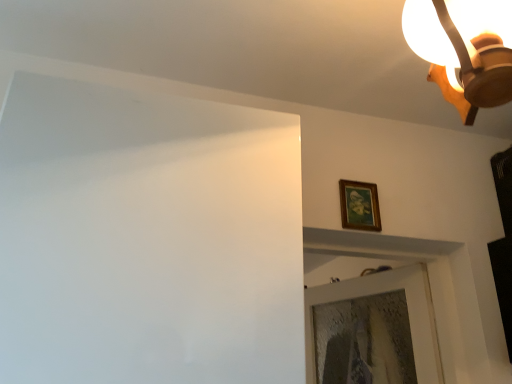
Question: Is wooden framed painting at upper right taller or shorter than wooden ceiling light at upper right?

Choices:
 (A) tall
 (B) short

Answer: (B)

Question: In terms of size, does wooden framed painting at upper right appear bigger or smaller than wooden ceiling light at upper right?

Choices:
 (A) big
 (B) small

Answer: (B)

Question: Considering the positions of wooden framed painting at upper right and wooden ceiling light at upper right in the image, is wooden framed painting at upper right wider or thinner than wooden ceiling light at upper right?

Choices:
 (A) thin
 (B) wide

Answer: (A)

Question: Choose the correct answer: Is wooden ceiling light at upper right inside wooden framed painting at upper right or outside it?

Choices:
 (A) inside
 (B) outside

Answer: (B)

Question: Considering the positions of wooden ceiling light at upper right and wooden framed painting at upper right in the image, is wooden ceiling light at upper right wider or thinner than wooden framed painting at upper right?

Choices:
 (A) thin
 (B) wide

Answer: (B)

Question: Considering the positions of point (458, 84) and point (372, 193), is point (458, 84) closer or farther from the camera than point (372, 193)?

Choices:
 (A) farther
 (B) closer

Answer: (B)

Question: Based on their positions, is wooden ceiling light at upper right located to the left or right of wooden framed painting at upper right?

Choices:
 (A) left
 (B) right

Answer: (B)